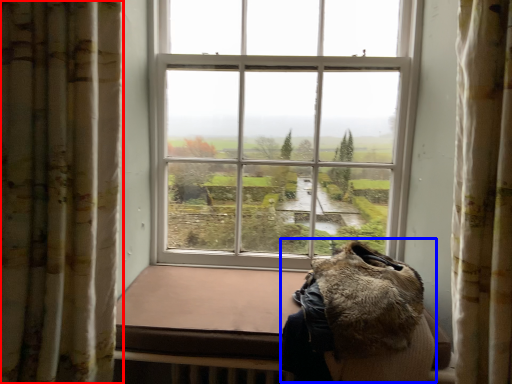
Question: Which of the following is the closest to the observer, curtain (highlighted by a red box) or animal (highlighted by a blue box)?

Choices:
 (A) curtain
 (B) animal

Answer: (A)